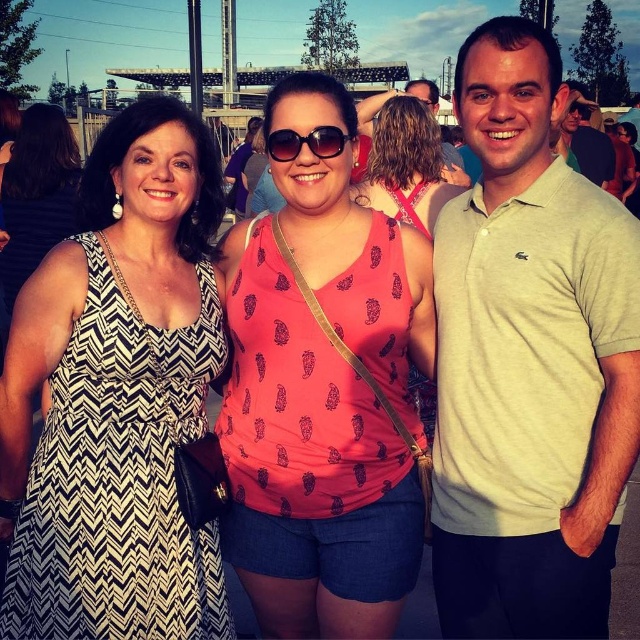
Question: Which point is closer to the camera taking this photo?

Choices:
 (A) (428, 189)
 (B) (600, 131)

Answer: (A)

Question: Is light green polo shirt at right closer to the viewer compared to sunglasses at center?

Choices:
 (A) no
 (B) yes

Answer: (B)

Question: Is light green polo shirt at right smaller than pineapple-patterned tank top at center?

Choices:
 (A) yes
 (B) no

Answer: (A)

Question: Among these points, which one is nearest to the camera?

Choices:
 (A) (193, 576)
 (B) (285, 152)
 (C) (593, 164)
 (D) (372, 580)

Answer: (A)

Question: Can you confirm if black zigzag dress at center is bigger than pineapple-patterned tank top at center?

Choices:
 (A) yes
 (B) no

Answer: (A)

Question: Based on their relative distances, which object is nearer to the sunglasses at center?

Choices:
 (A) light green polo shirt at right
 (B) black zigzag dress at center
 (C) pink printed tank top at center

Answer: (A)